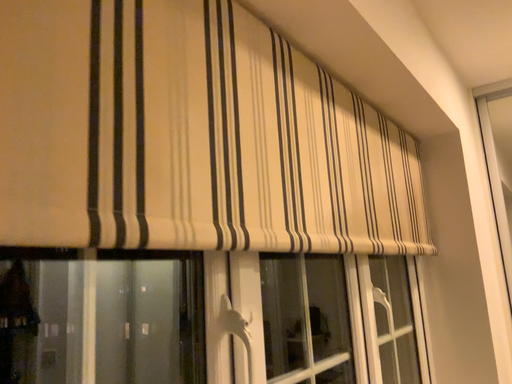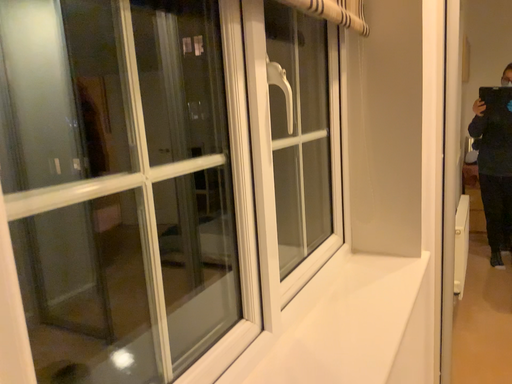
Question: How did the camera likely rotate when shooting the video?

Choices:
 (A) rotated right
 (B) rotated left

Answer: (A)